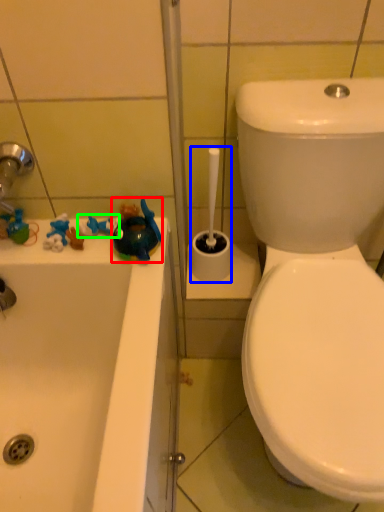
Question: Which object is positioned closest to toy (highlighted by a red box)? Select from shower (highlighted by a blue box) and toy (highlighted by a green box).

Choices:
 (A) shower
 (B) toy

Answer: (B)